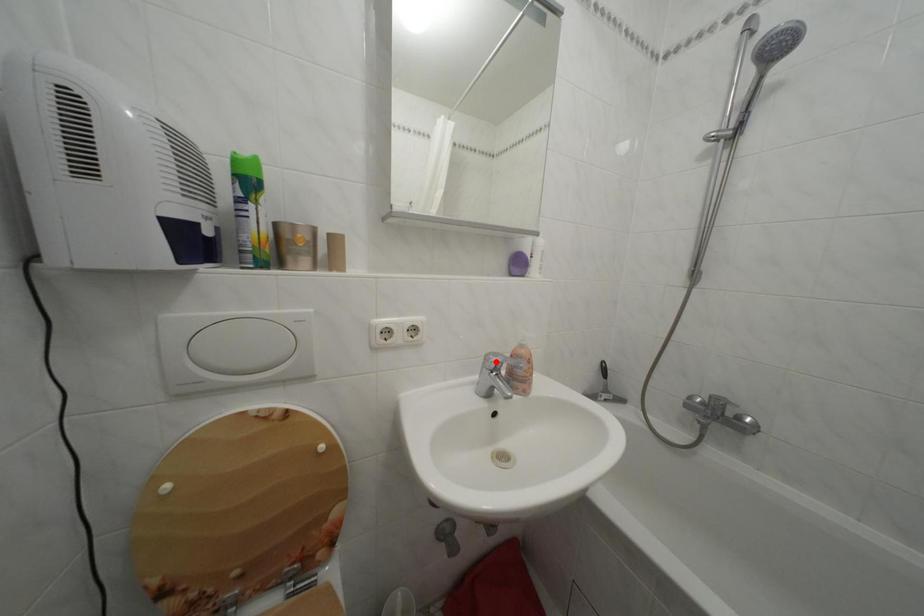
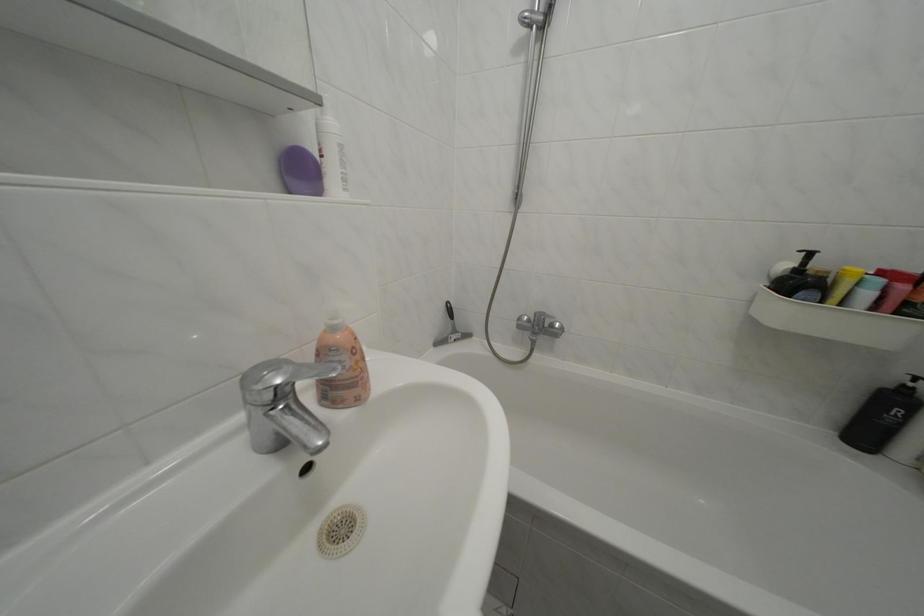
Locate, in the second image, the point that corresponds to the highlighted location in the first image.

(252, 384)